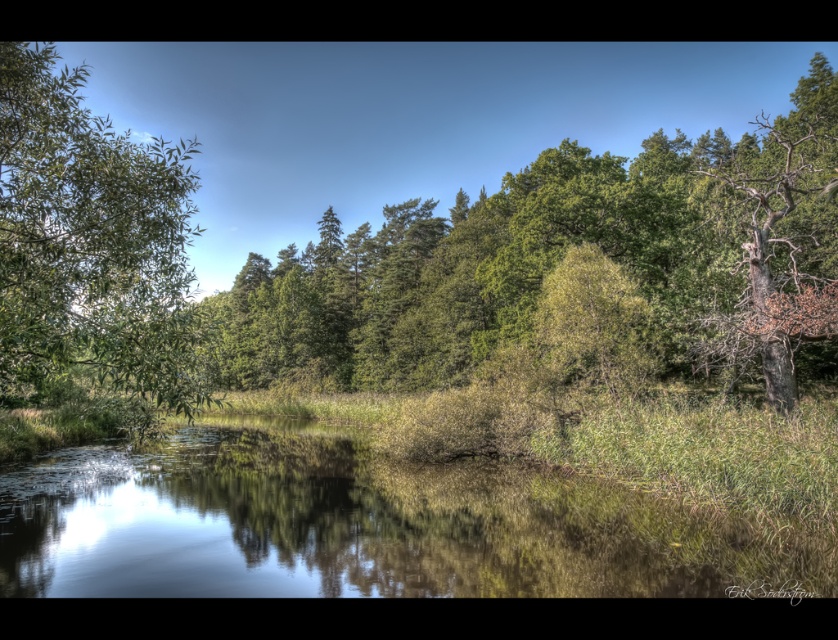
Question: Which of these objects is positioned closest to the green grassy lake at center?

Choices:
 (A) green leafy tree at center
 (B) green leafy tree at left

Answer: (B)

Question: Does green leafy tree at center lie in front of green leafy tree at left?

Choices:
 (A) yes
 (B) no

Answer: (B)

Question: Can you confirm if green grassy lake at center is positioned above green leafy tree at center?

Choices:
 (A) no
 (B) yes

Answer: (A)

Question: Which point is farther to the camera?

Choices:
 (A) green leafy tree at left
 (B) green grassy lake at center
 (C) green leafy tree at center

Answer: (B)

Question: Which of the following is the farthest from the observer?

Choices:
 (A) (526, 230)
 (B) (148, 358)

Answer: (A)

Question: Does green grassy lake at center have a smaller size compared to green leafy tree at left?

Choices:
 (A) no
 (B) yes

Answer: (B)